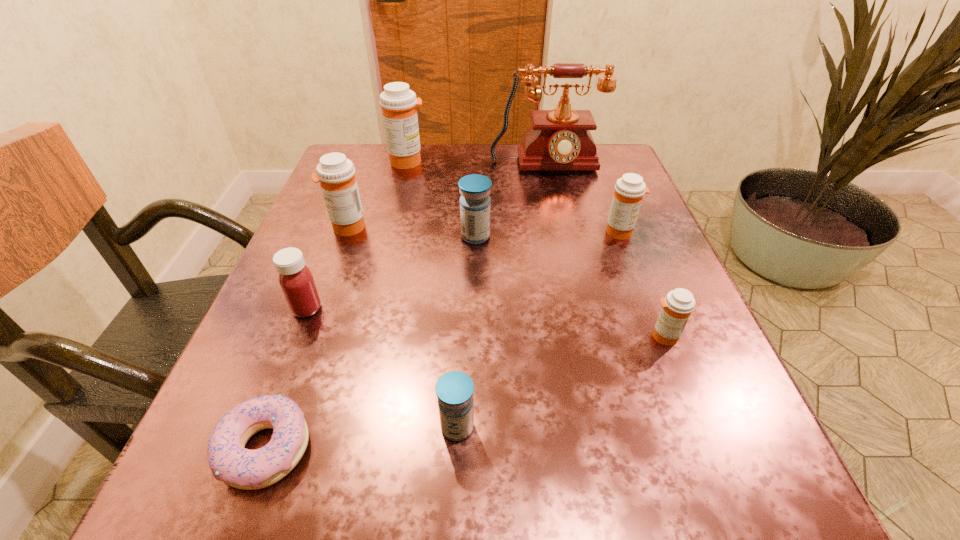
Identify which medicine is the fourth nearest to the seventh farthest object. Please provide its 2D coordinates. Your answer should be formatted as a tuple, i.e. [(x, y)], where the tuple contains the x and y coordinates of a point satisfying the conditions above.

[(296, 281)]

Locate which medicine is the sixth closest to the second biggest orange medicine. Please provide its 2D coordinates. Your answer should be formatted as a tuple, i.e. [(x, y)], where the tuple contains the x and y coordinates of a point satisfying the conditions above.

[(677, 306)]

Identify which orange medicine is the fourth nearest to the red medicine. Please provide its 2D coordinates. Your answer should be formatted as a tuple, i.e. [(x, y)], where the tuple contains the x and y coordinates of a point satisfying the conditions above.

[(629, 190)]

You are a GUI agent. You are given a task and a screenshot of the screen. Output one action in this format:
    pyautogui.click(x=<x>, y=<y>)
    Task: Click on the orange medicine object that ranks as the second closest to the third smallest orange medicine
    This screenshot has height=540, width=960.
    Given the screenshot: What is the action you would take?
    pyautogui.click(x=629, y=190)

You are a GUI agent. You are given a task and a screenshot of the screen. Output one action in this format:
    pyautogui.click(x=<x>, y=<y>)
    Task: Click on the vacant region that satisfies the following two spatial constraints: 1. on the back side of the fourth nearest object; 2. on the right side of the seventh shortest object
    
    Given the screenshot: What is the action you would take?
    pyautogui.click(x=339, y=227)

Find the location of `vacant region that satisfies the following two spatial constraints: 1. on the back side of the sixth farthest medicine; 2. on the left side of the nearest medicine`. vacant region that satisfies the following two spatial constraints: 1. on the back side of the sixth farthest medicine; 2. on the left side of the nearest medicine is located at coordinates (461, 336).

What are the coordinates of `blank space that satisfies the following two spatial constraints: 1. on the dial of the telephone; 2. on the right side of the smallest orange medicine` in the screenshot? It's located at (583, 336).